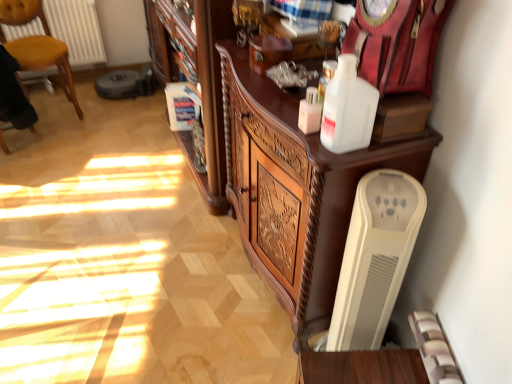
Question: From a real-world perspective, relative to yellow upholstered chair at left, is white plastic heater at lower right vertically above or below?

Choices:
 (A) below
 (B) above

Answer: (A)

Question: Considering the positions of point (377, 170) and point (56, 44), is point (377, 170) closer or farther from the camera than point (56, 44)?

Choices:
 (A) closer
 (B) farther

Answer: (A)

Question: Which object is the farthest from the wooden cabinet at center?

Choices:
 (A) brown carved wood dresser at center
 (B) white plastic radiator at upper left
 (C) white plastic bottle at upper center, which appears as the second bottle when viewed from the left
 (D) white glossy bottle at upper center, the 2th bottle in the right-to-left sequence
 (E) white plastic heater at lower right

Answer: (B)

Question: Which object is the farthest from the white plastic radiator at upper left?

Choices:
 (A) velvet black armchair at left
 (B) yellow upholstered chair at left
 (C) wooden cabinet at center
 (D) white plastic heater at lower right
 (E) white plastic bottle at upper center, positioned as the first bottle in right-to-left order

Answer: (D)